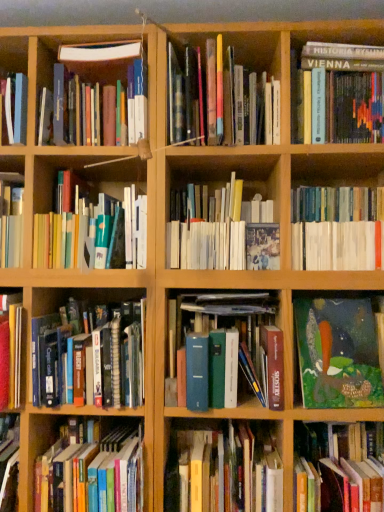
What do you see at coordinates (94, 234) in the screenshot? The image size is (384, 512). I see `matte hardcover books at center left, the 4th book from the top` at bounding box center [94, 234].

This screenshot has height=512, width=384. Find the location of `hardcover book at upper right, which is counted as the 10th book, starting from the bottom`. hardcover book at upper right, which is counted as the 10th book, starting from the bottom is located at coordinates (339, 94).

What do you see at coordinates (337, 228) in the screenshot? I see `white paperbacks at center-right, which is counted as the 5th book, starting from the top` at bounding box center [337, 228].

This screenshot has width=384, height=512. I want to click on white paperbacks at center-right, which is the eighth book from bottom to top, so click(x=337, y=228).

Describe the element at coordinates (224, 469) in the screenshot. This screenshot has height=512, width=384. I see `hardcover book at center, placed as the 12th book when sorted from top to bottom` at that location.

This screenshot has height=512, width=384. I want to click on matte hardcover books at center left, marked as the ninth book in a bottom-to-top arrangement, so click(x=94, y=234).

Considering the sizes of green matte book at lower right, the 3th book when ordered from bottom to top, and hardcover books at center, acting as the 7th book starting from the bottom, in the image, is green matte book at lower right, the 3th book when ordered from bottom to top, taller or shorter than hardcover books at center, acting as the 7th book starting from the bottom,?

green matte book at lower right, the 3th book when ordered from bottom to top, is shorter than hardcover books at center, acting as the 7th book starting from the bottom.

Is green matte book at lower right, the tenth book viewed from the top, directly adjacent to hardcover books at center, acting as the 7th book starting from the bottom?

green matte book at lower right, the tenth book viewed from the top, is not next to hardcover books at center, acting as the 7th book starting from the bottom, and they're not touching.

In the scene shown: From a real-world perspective, between green matte book at lower right, the 3th book when ordered from bottom to top, and hardcover books at center, acting as the 7th book starting from the bottom, who is vertically lower?

From a 3D spatial view, green matte book at lower right, the 3th book when ordered from bottom to top, is below.

Is green textured painting at lower right, which is the fifth book from bottom to top, at the left side of hardcover books at center left, the 6th book from the bottom?

No.

Is green textured painting at lower right, the eighth book in the top-to-bottom sequence, completely or partially outside of hardcover books at center left, the 6th book from the bottom?

That's correct, green textured painting at lower right, the eighth book in the top-to-bottom sequence, is outside of hardcover books at center left, the 6th book from the bottom.

Looking at this image, between green textured painting at lower right, the eighth book in the top-to-bottom sequence, and hardcover books at center left, which is the 7th book from top to bottom, which one is positioned in front?

green textured painting at lower right, the eighth book in the top-to-bottom sequence.

From a real-world perspective, which is physically above, green textured painting at lower right, which is the fifth book from bottom to top, or hardcover books at center left, the 6th book from the bottom?

hardcover books at center left, the 6th book from the bottom.

At what (x,y) coordinates should I click in order to perform the action: click on the 3rd book in front of the hardcover books at center left, the 6th book from the bottom, counting from the anchor's position. Please return your answer as a coordinate pair (x, y). The image size is (384, 512). Looking at the image, I should click on (227, 351).

From the picture: Visually, is hardcover books at center left, which is the 7th book from top to bottom, positioned to the left or to the right of blue hardcover book at center, arranged as the 9th book when viewed from the top?

hardcover books at center left, which is the 7th book from top to bottom, is positioned on blue hardcover book at center, arranged as the 9th book when viewed from the top,'s left side.

From the image's perspective, is hardcover books at center left, the 6th book from the bottom, above or below blue hardcover book at center, which ranks as the 4th book in bottom-to-top order?

Clearly, from the image's perspective, hardcover books at center left, the 6th book from the bottom, is above blue hardcover book at center, which ranks as the 4th book in bottom-to-top order.

From the image's perspective, does hardcover book at upper right, which is counted as the 10th book, starting from the bottom, appear lower than green textured painting at lower right, which is the fifth book from bottom to top?

No.

Which book is the 6th one when counting from the front of the hardcover book at upper right, which ranks as the third book in top-to-bottom order? Please provide its 2D coordinates.

[(338, 353)]

Looking at this image, measure the distance between hardcover book at upper right, which ranks as the third book in top-to-bottom order, and green textured painting at lower right, the eighth book in the top-to-bottom sequence.

hardcover book at upper right, which ranks as the third book in top-to-bottom order, and green textured painting at lower right, the eighth book in the top-to-bottom sequence, are 65.63 centimeters apart from each other.

Is hardcover book at center, which is the eleventh book from bottom to top, oriented away from hardcover books at center left, the 6th book from the bottom?

hardcover book at center, which is the eleventh book from bottom to top, is not turned away from hardcover books at center left, the 6th book from the bottom.

Would you say hardcover book at center, positioned as the 2th book in top-to-bottom order, is to the left or to the right of hardcover books at center left, which is the 7th book from top to bottom, in the picture?

hardcover book at center, positioned as the 2th book in top-to-bottom order, is to the right of hardcover books at center left, which is the 7th book from top to bottom.

Identify the location of the 2nd book in front when counting from the hardcover book at center, positioned as the 2th book in top-to-bottom order. The height and width of the screenshot is (512, 384). (91, 357).

How distant is hardcover book at center, which is the eleventh book from bottom to top, from hardcover books at center left, the 6th book from the bottom?

They are 26.51 inches apart.

Is green textured painting at lower right, the eighth book in the top-to-bottom sequence, positioned with its back to hardcover book at center, placed as the 12th book when sorted from top to bottom?

No, green textured painting at lower right, the eighth book in the top-to-bottom sequence, is not facing the opposite direction of hardcover book at center, placed as the 12th book when sorted from top to bottom.

From the picture: Which is more to the left, green textured painting at lower right, the eighth book in the top-to-bottom sequence, or hardcover book at center, placed as the 12th book when sorted from top to bottom?

From the viewer's perspective, hardcover book at center, placed as the 12th book when sorted from top to bottom, appears more on the left side.

How different are the orientations of green textured painting at lower right, which is the fifth book from bottom to top, and hardcover book at center, placed as the 12th book when sorted from top to bottom, in degrees?

8.38 degrees.

Considering the relative sizes of green textured painting at lower right, which is the fifth book from bottom to top, and hardcover book at center, placed as the 12th book when sorted from top to bottom, in the image provided, is green textured painting at lower right, which is the fifth book from bottom to top, thinner than hardcover book at center, placed as the 12th book when sorted from top to bottom,?

Yes, green textured painting at lower right, which is the fifth book from bottom to top, is thinner than hardcover book at center, placed as the 12th book when sorted from top to bottom.

Based on the photo, from a real-world perspective, is hardcover book at lower left, the 11th book positioned from the top, positioned above or below hardcover books at center, which ranks as the 6th book in top-to-bottom order?

hardcover book at lower left, the 11th book positioned from the top, is situated lower than hardcover books at center, which ranks as the 6th book in top-to-bottom order, in the real world.

Can you confirm if hardcover book at lower left, which is the second book in bottom-to-top order, is wider than hardcover books at center, acting as the 7th book starting from the bottom?

No, hardcover book at lower left, which is the second book in bottom-to-top order, is not wider than hardcover books at center, acting as the 7th book starting from the bottom.

Is hardcover book at lower left, the 11th book positioned from the top, facing towards hardcover books at center, which ranks as the 6th book in top-to-bottom order?

No, hardcover book at lower left, the 11th book positioned from the top, is not turned towards hardcover books at center, which ranks as the 6th book in top-to-bottom order.

Is hardcover book at lower left, the 11th book positioned from the top, positioned behind hardcover books at center, acting as the 7th book starting from the bottom?

No, hardcover book at lower left, the 11th book positioned from the top, is closer to the viewer.

Image resolution: width=384 pixels, height=512 pixels. I want to click on the 4th book to the right when counting from the hardcover books at center, which ranks as the 6th book in top-to-bottom order, so click(x=337, y=468).

You are a GUI agent. You are given a task and a screenshot of the screen. Output one action in this format:
    pyautogui.click(x=<x>, y=<y>)
    Task: Click on the 2nd book in front of the hardcover books at center left, which is the 7th book from top to bottom, counting from the anchor's position
    This screenshot has width=384, height=512.
    Given the screenshot: What is the action you would take?
    pyautogui.click(x=338, y=353)

Considering their positions, is hardcover book at center, which appears as the 1th book when viewed from the top, positioned further to matte hardcover books at center left, marked as the ninth book in a bottom-to-top arrangement, than hardcover book at lower left, the 11th book positioned from the top?

The object further to matte hardcover books at center left, marked as the ninth book in a bottom-to-top arrangement, is hardcover book at lower left, the 11th book positioned from the top.

From the image, which object appears to be nearer to hardcover book at center, the twelfth book when ordered from bottom to top, hardcover books at center left, which is the 7th book from top to bottom, or hardcover book at center, which is the eleventh book from bottom to top?

hardcover book at center, which is the eleventh book from bottom to top.

Considering their positions, is hardcover book at lower left, which is the second book in bottom-to-top order, positioned closer to hardcover book at center, the twelfth book when ordered from bottom to top, than white paperbacks at center-right, which is counted as the 5th book, starting from the top?

white paperbacks at center-right, which is counted as the 5th book, starting from the top, is closer to hardcover book at center, the twelfth book when ordered from bottom to top.

Based on their spatial positions, is hardcover books at center, which ranks as the 6th book in top-to-bottom order, or hardcover book at lower left, the 11th book positioned from the top, closer to blue hardcover book at center, which ranks as the 4th book in bottom-to-top order?

hardcover books at center, which ranks as the 6th book in top-to-bottom order, is positioned closer to the anchor blue hardcover book at center, which ranks as the 4th book in bottom-to-top order.

Estimate the real-world distances between objects in this image. Which object is further from hardcover book at lower left, which is the second book in bottom-to-top order, hardcover book at upper right, which is counted as the 10th book, starting from the bottom, or matte hardcover books at center left, the 4th book from the top?

hardcover book at upper right, which is counted as the 10th book, starting from the bottom, is positioned further to the anchor hardcover book at lower left, which is the second book in bottom-to-top order.

Considering their positions, is hardcover books at center left, the 6th book from the bottom, positioned further to hardcover book at upper right, which is counted as the 10th book, starting from the bottom, than hardcover book at center, positioned as the 2th book in top-to-bottom order?

hardcover books at center left, the 6th book from the bottom, is positioned further to the anchor hardcover book at upper right, which is counted as the 10th book, starting from the bottom.

Estimate the real-world distances between objects in this image. Which object is closer to green textured painting at lower right, which is the fifth book from bottom to top, hardcover book at center, which appears as the 1th book when viewed from the top, or hardcover book at center, positioned as the 2th book in top-to-bottom order?

hardcover book at center, which appears as the 1th book when viewed from the top, is positioned closer to the anchor green textured painting at lower right, which is the fifth book from bottom to top.

Based on their spatial positions, is hardcover book at center, which appears as the 1th book when viewed from the top, or white paperbacks at center-right, which is the eighth book from bottom to top, further from green textured painting at lower right, which is the fifth book from bottom to top?

hardcover book at center, which appears as the 1th book when viewed from the top, is positioned further to the anchor green textured painting at lower right, which is the fifth book from bottom to top.

Locate an element on the screen. This screenshot has height=512, width=384. book between green textured painting at lower right, the eighth book in the top-to-bottom sequence, and green matte book at lower right, the 3th book when ordered from bottom to top, in the vertical direction is located at coordinates (227, 351).